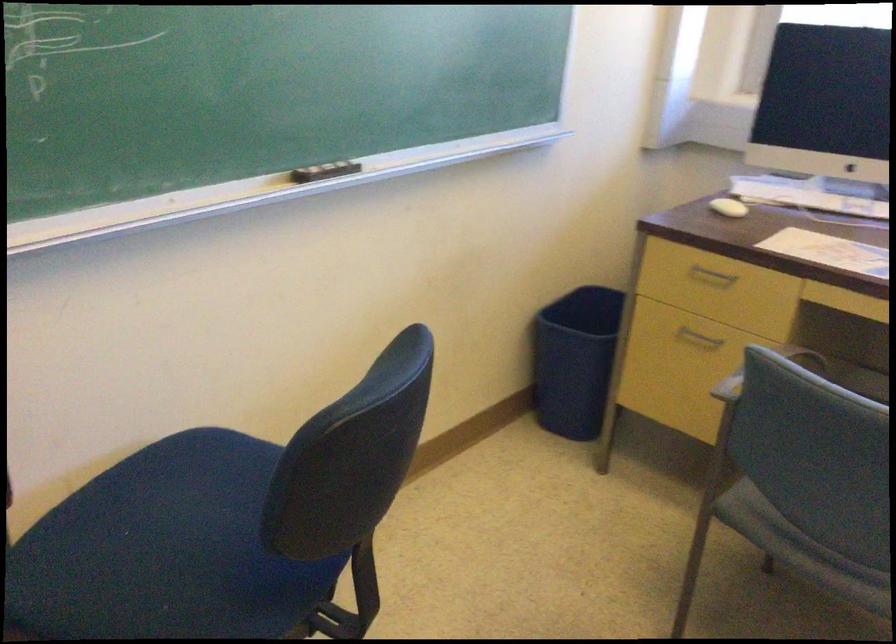
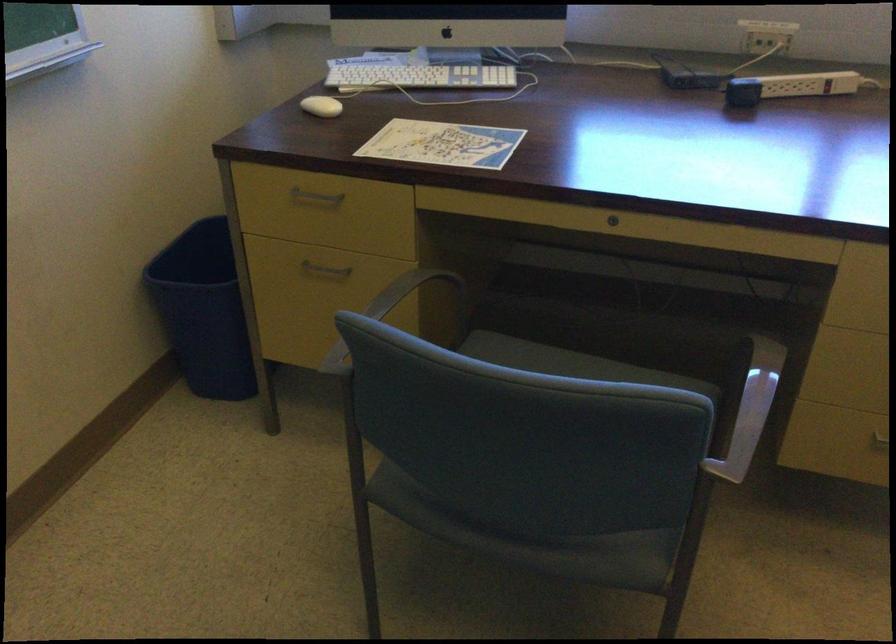
The point at (705, 333) is marked in the first image. Where is the corresponding point in the second image?

(324, 269)